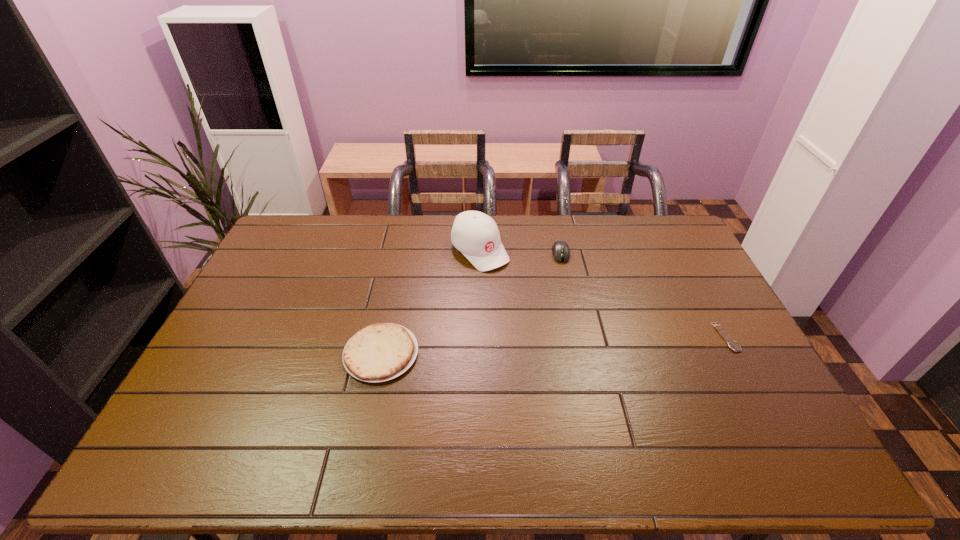
Find the location of `free area in between the computer mouse and the watch`. free area in between the computer mouse and the watch is located at coordinates (643, 295).

Image resolution: width=960 pixels, height=540 pixels. In order to click on free space that is in between the second object from right to left and the tallest object in this screenshot , I will do `click(520, 252)`.

Locate which object ranks second in proximity to the computer mouse. Please provide its 2D coordinates. Your answer should be formatted as a tuple, i.e. [(x, y)], where the tuple contains the x and y coordinates of a point satisfying the conditions above.

[(733, 345)]

This screenshot has height=540, width=960. I want to click on object identified as the closest to the leftmost object, so click(x=475, y=234).

Find the location of a particular element. This screenshot has width=960, height=540. vacant area in the image that satisfies the following two spatial constraints: 1. on the front side of the baseball cap; 2. on the right side of the second object from right to left is located at coordinates (480, 253).

The height and width of the screenshot is (540, 960). Find the location of `vacant region that satisfies the following two spatial constraints: 1. on the back side of the tortilla; 2. on the left side of the baseball cap`. vacant region that satisfies the following two spatial constraints: 1. on the back side of the tortilla; 2. on the left side of the baseball cap is located at coordinates (402, 251).

The width and height of the screenshot is (960, 540). What are the coordinates of `vacant point that satisfies the following two spatial constraints: 1. on the back side of the third object from right to left; 2. on the left side of the tortilla` in the screenshot? It's located at (402, 251).